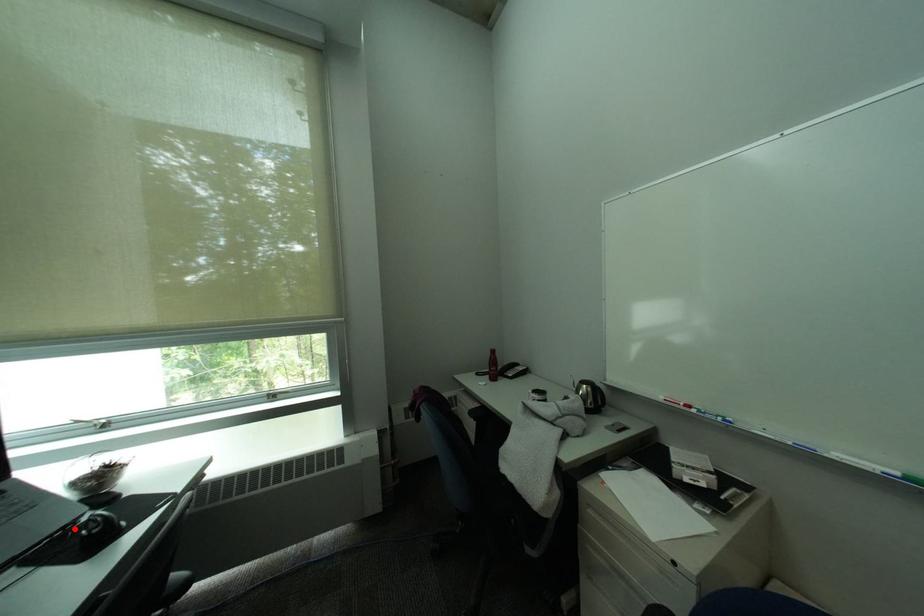
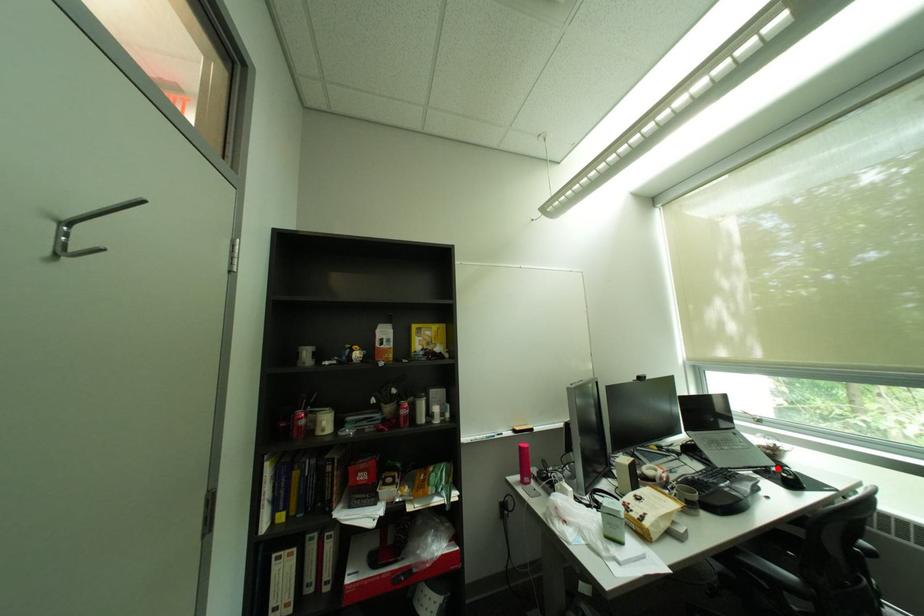
I am providing you with two images of the same scene from different viewpoints. A red point is marked on the first image and another point is marked on the second image. Do the highlighted points in image1 and image2 indicate the same real-world spot?

Yes